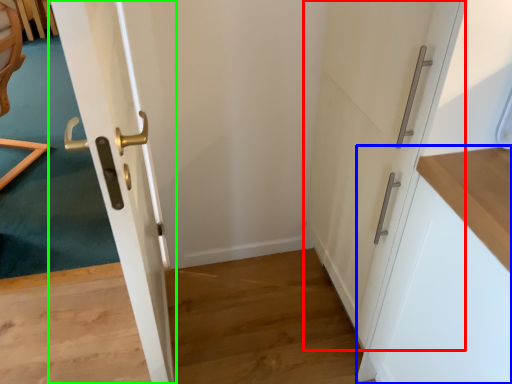
Question: Based on their relative distances, which object is nearer to door (highlighted by a red box)? Choose from cabinetry (highlighted by a blue box) and door (highlighted by a green box).

Choices:
 (A) cabinetry
 (B) door

Answer: (A)